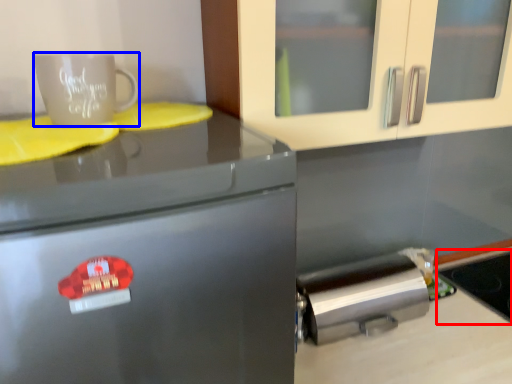
Question: Which of the following is the farthest to the observer, appliance (highlighted by a red box) or coffee cup (highlighted by a blue box)?

Choices:
 (A) appliance
 (B) coffee cup

Answer: (A)